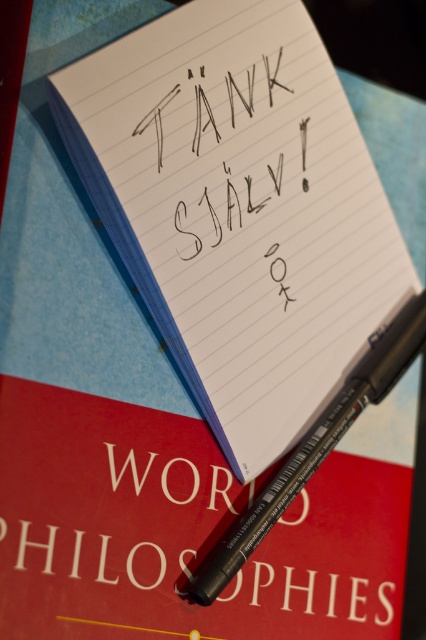
Question: Where is white lined paper at center located in relation to black matte pen at lower center in the image?

Choices:
 (A) left
 (B) right

Answer: (A)

Question: Can you confirm if white lined paper at center is bigger than black matte pen at lower center?

Choices:
 (A) no
 (B) yes

Answer: (B)

Question: Can you confirm if white lined paper at center is smaller than black matte pen at lower center?

Choices:
 (A) no
 (B) yes

Answer: (A)

Question: Among these objects, which one is nearest to the camera?

Choices:
 (A) white lined paper at center
 (B) black matte pen at lower center

Answer: (A)